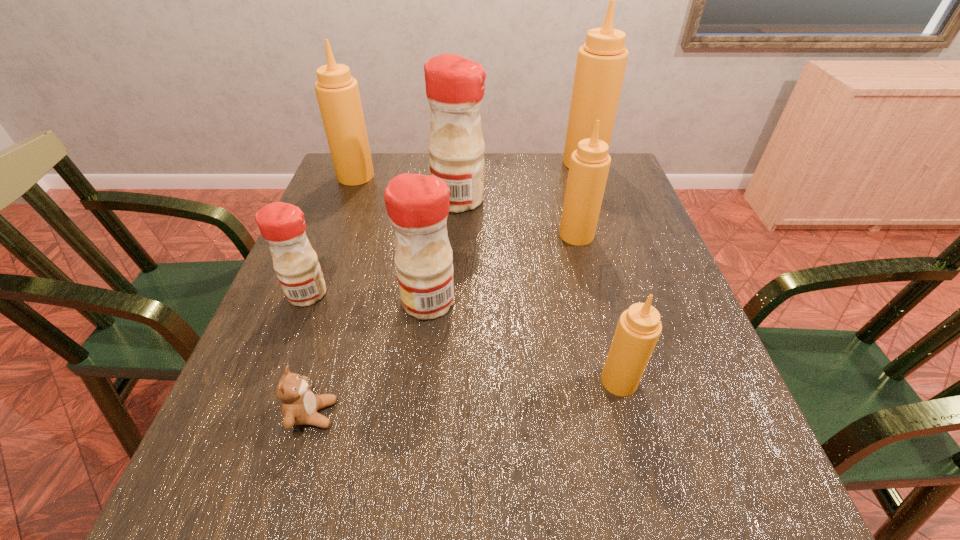
I want to click on the shortest object, so click(x=300, y=405).

Find the location of a particular element. The height and width of the screenshot is (540, 960). vacant space located on the left of the tallest condiment is located at coordinates (466, 163).

The image size is (960, 540). I want to click on free space located on the right of the farthest red condiment, so click(597, 200).

You are a GUI agent. You are given a task and a screenshot of the screen. Output one action in this format:
    pyautogui.click(x=<x>, y=<y>)
    Task: Click on the vacant space located on the front of the leftmost tan condiment
    The image size is (960, 540).
    Given the screenshot: What is the action you would take?
    pyautogui.click(x=343, y=211)

Identify the location of blank area located 0.070m on the right of the fourth farthest condiment. This screenshot has height=540, width=960. (622, 235).

The height and width of the screenshot is (540, 960). Find the location of `vacant space positioned 0.090m on the left of the second biggest red condiment`. vacant space positioned 0.090m on the left of the second biggest red condiment is located at coordinates (360, 301).

This screenshot has height=540, width=960. I want to click on blank area located on the right of the smallest red condiment, so click(451, 294).

Locate an element on the screen. free point located 0.090m on the back of the smallest tan condiment is located at coordinates pos(606,329).

Where is `free space located 0.070m on the front-facing side of the teddy bear`? Image resolution: width=960 pixels, height=540 pixels. free space located 0.070m on the front-facing side of the teddy bear is located at coordinates [x=376, y=414].

Locate an element on the screen. teddy bear present at the left edge is located at coordinates (300, 405).